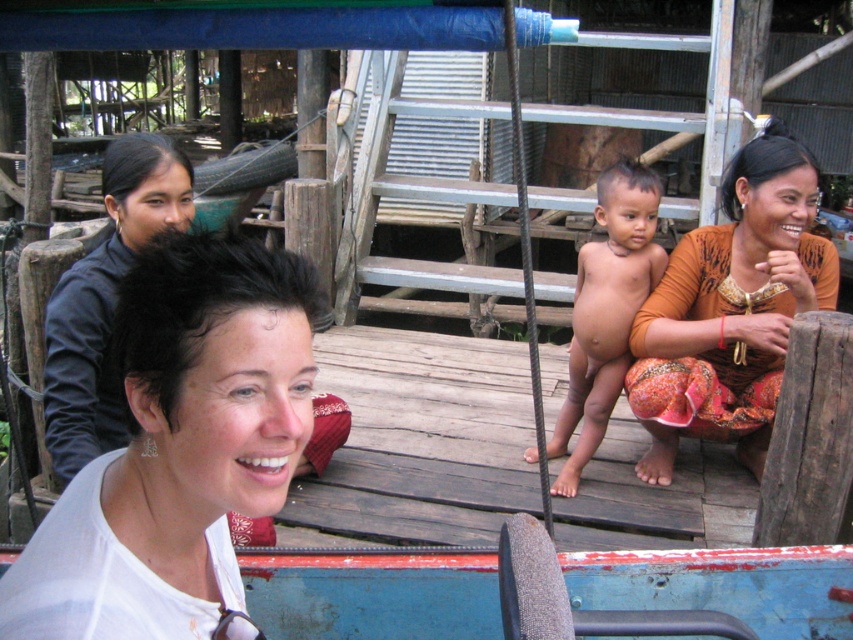
Question: Does orange fabric at right appear over smooth skin baby at center?

Choices:
 (A) yes
 (B) no

Answer: (A)

Question: Can you confirm if white matte shirt at upper left is wider than orange fabric at right?

Choices:
 (A) yes
 (B) no

Answer: (B)

Question: Based on their relative distances, which object is farther from the smooth skin baby at center?

Choices:
 (A) white matte shirt at upper left
 (B) orange fabric at right

Answer: (A)

Question: Which of the following is the closest to the observer?

Choices:
 (A) smooth skin baby at center
 (B) white matte shirt at upper left
 (C) orange fabric at right

Answer: (B)

Question: Which of the following is the closest to the observer?

Choices:
 (A) (795, 252)
 (B) (643, 237)

Answer: (B)

Question: Can you confirm if orange fabric at right is bigger than smooth skin baby at center?

Choices:
 (A) no
 (B) yes

Answer: (B)